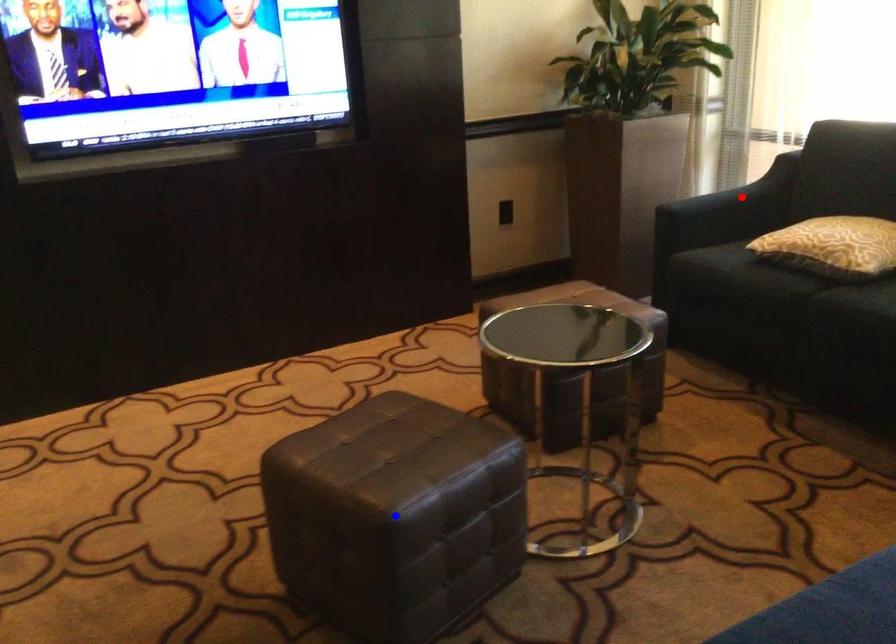
Question: In the image, two points are highlighted. Which point is nearer to the camera? Reply with the corresponding letter.

Choices:
 (A) blue point
 (B) red point

Answer: (A)